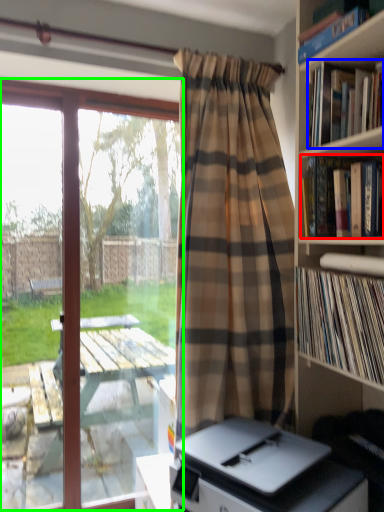
Question: Which is farther away from book (highlighted by a red box)? book (highlighted by a blue box) or window (highlighted by a green box)?

Choices:
 (A) book
 (B) window

Answer: (B)